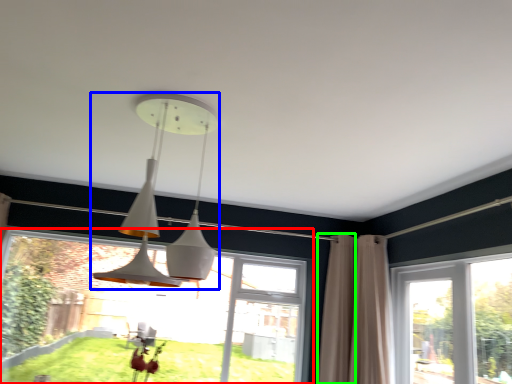
Question: Which object is positioned closest to window (highlighted by a red box)? Select from lamp (highlighted by a blue box) and curtain (highlighted by a green box).

Choices:
 (A) lamp
 (B) curtain

Answer: (B)